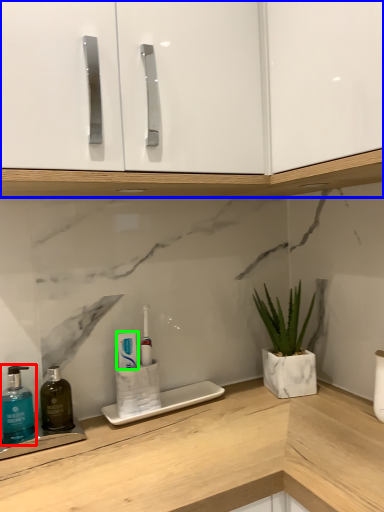
Question: Which is nearer to the soap dispenser (highlighted by a red box)? cabinetry (highlighted by a blue box) or toothpaste (highlighted by a green box).

Choices:
 (A) cabinetry
 (B) toothpaste

Answer: (B)